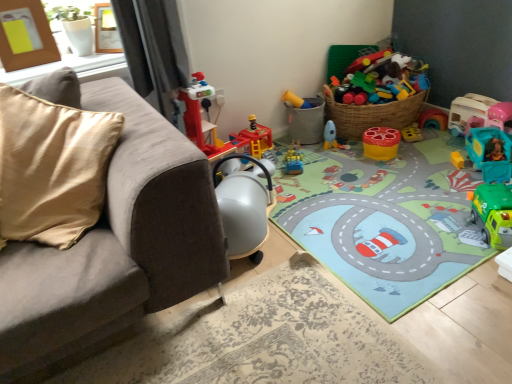
Find the location of a particular element. Image resolution: width=512 pixels, height=384 pixels. free spot to the left of green plastic toy car at lower right, placed as the 3th toy when sorted from right to left is located at coordinates (449, 234).